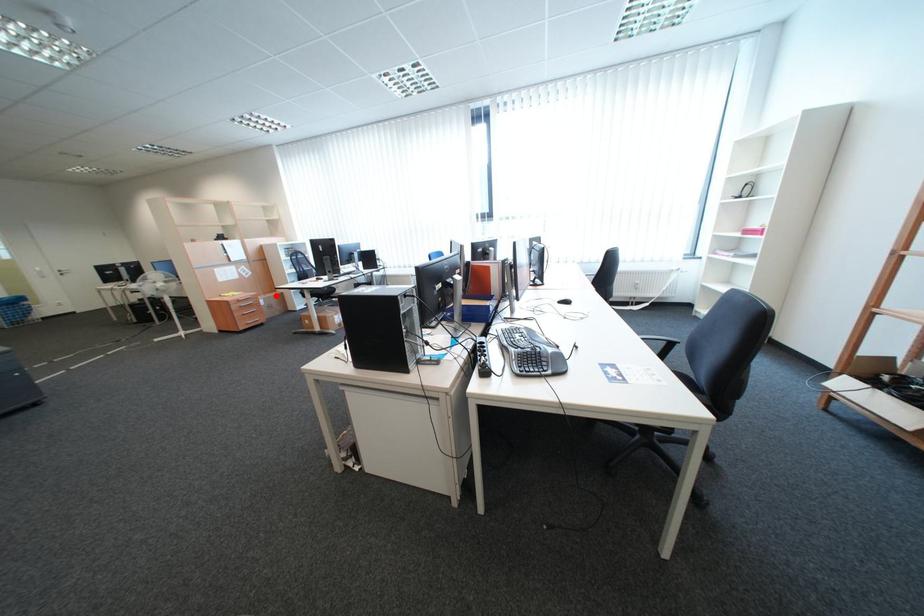
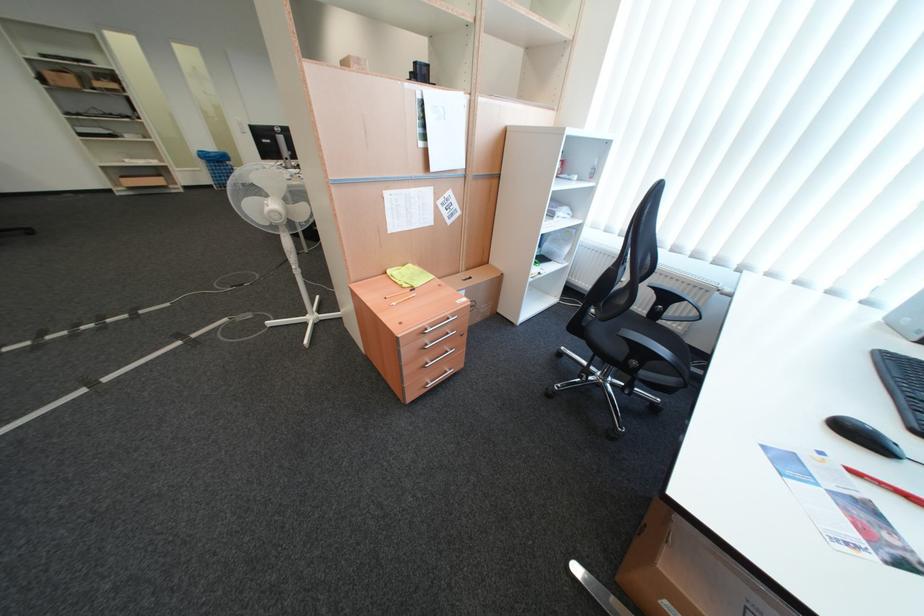
The point at the highlighted location is marked in the first image. Where is the corresponding point in the second image?

(479, 272)